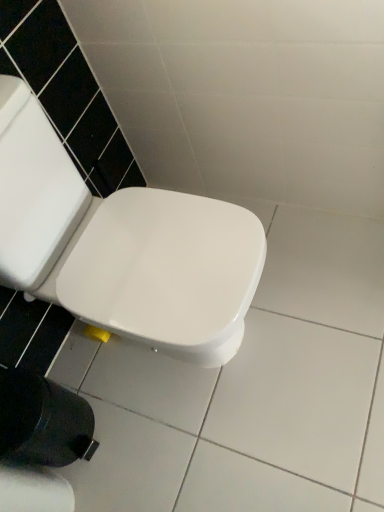
Question: Is white glossy toilet seat at center completely or partially outside of white paper at lower left?

Choices:
 (A) no
 (B) yes

Answer: (B)

Question: Is white glossy toilet seat at center placed right next to white paper at lower left?

Choices:
 (A) yes
 (B) no

Answer: (B)

Question: From the image's perspective, is white glossy toilet seat at center on white paper at lower left?

Choices:
 (A) no
 (B) yes

Answer: (B)

Question: Does white glossy toilet seat at center have a greater height compared to white paper at lower left?

Choices:
 (A) yes
 (B) no

Answer: (A)

Question: From a real-world perspective, is white glossy toilet seat at center physically above white paper at lower left?

Choices:
 (A) no
 (B) yes

Answer: (B)

Question: Is white glossy toilet seat at center at the left side of white paper at lower left?

Choices:
 (A) no
 (B) yes

Answer: (A)

Question: From a real-world perspective, is white paper at lower left on white glossy toilet seat at center?

Choices:
 (A) no
 (B) yes

Answer: (A)

Question: Considering the relative sizes of white paper at lower left and white glossy toilet seat at center in the image provided, is white paper at lower left bigger than white glossy toilet seat at center?

Choices:
 (A) yes
 (B) no

Answer: (B)

Question: Is white paper at lower left not within white glossy toilet seat at center?

Choices:
 (A) yes
 (B) no

Answer: (A)

Question: Is white paper at lower left oriented away from white glossy toilet seat at center?

Choices:
 (A) yes
 (B) no

Answer: (B)

Question: Does white paper at lower left have a lesser height compared to white glossy toilet seat at center?

Choices:
 (A) yes
 (B) no

Answer: (A)

Question: Is white glossy toilet seat at center completely or partially inside white paper at lower left?

Choices:
 (A) no
 (B) yes

Answer: (A)

Question: From the image's perspective, is white glossy toilet seat at center located above or below white paper at lower left?

Choices:
 (A) below
 (B) above

Answer: (B)